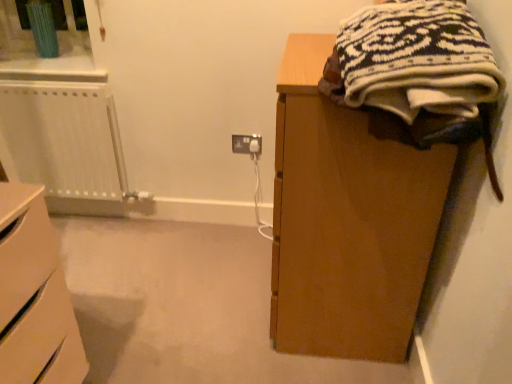
Question: Looking at the image, does matte white socket at center seem bigger or smaller compared to white matte chest of drawers at lower left?

Choices:
 (A) small
 (B) big

Answer: (A)

Question: Which is correct: matte white socket at center is inside white matte chest of drawers at lower left, or outside of it?

Choices:
 (A) inside
 (B) outside

Answer: (B)

Question: Considering the real-world distances, which object is closest to the matte white socket at center?

Choices:
 (A) knitted wool sweater at upper right
 (B) white plastic radiator at left
 (C) white matte chest of drawers at lower left

Answer: (B)

Question: Which is nearer to the matte white socket at center?

Choices:
 (A) white matte chest of drawers at lower left
 (B) white plastic radiator at left
 (C) knitted wool sweater at upper right

Answer: (B)